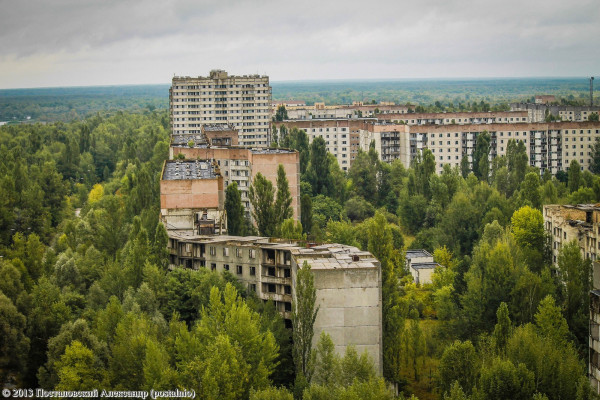
At what (x,y) coordinates should I click in order to perform the action: click on window. Please return your answer as a coordinate pair (x, y). Looking at the image, I should click on (456, 143).